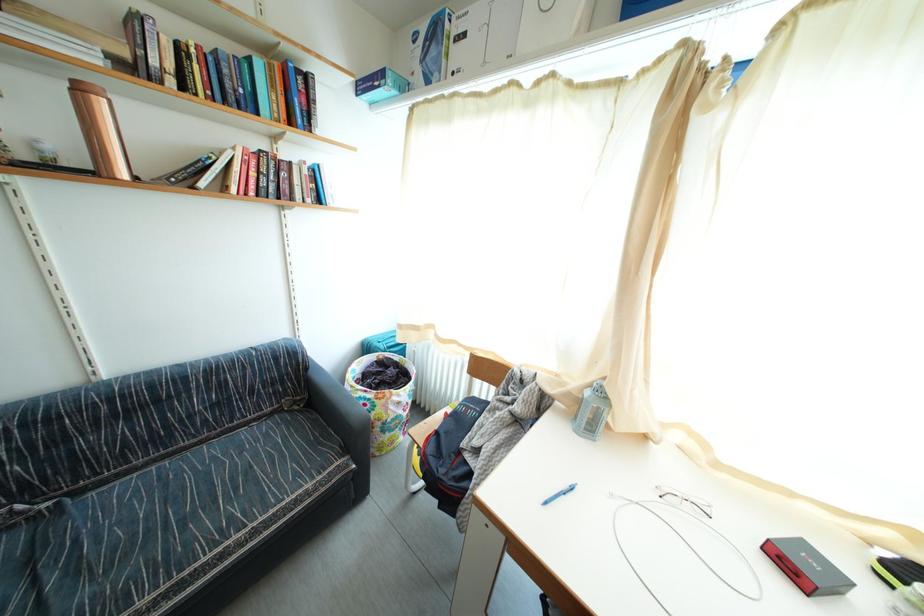
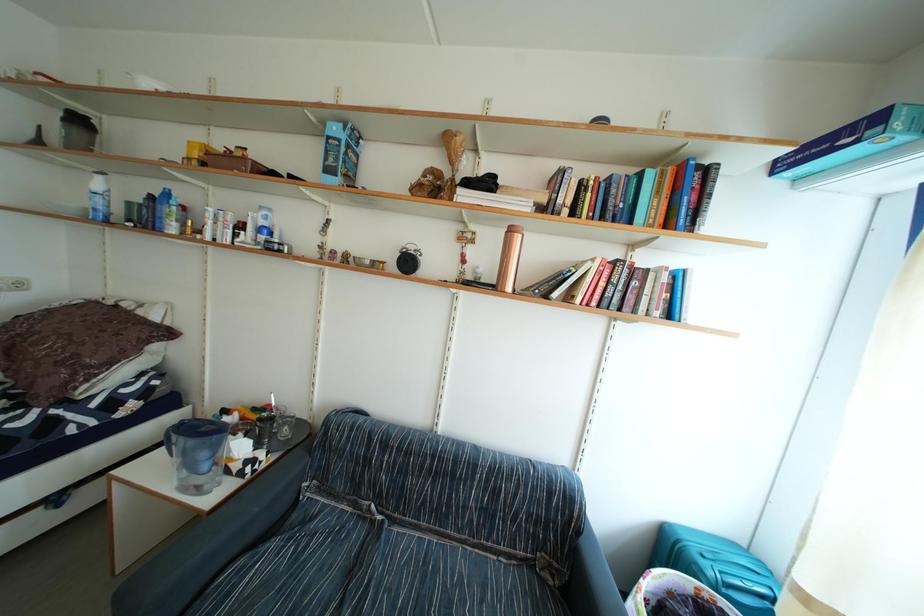
Question: How did the camera likely rotate?

Choices:
 (A) Left
 (B) Right
 (C) Up
 (D) Down

Answer: (A)